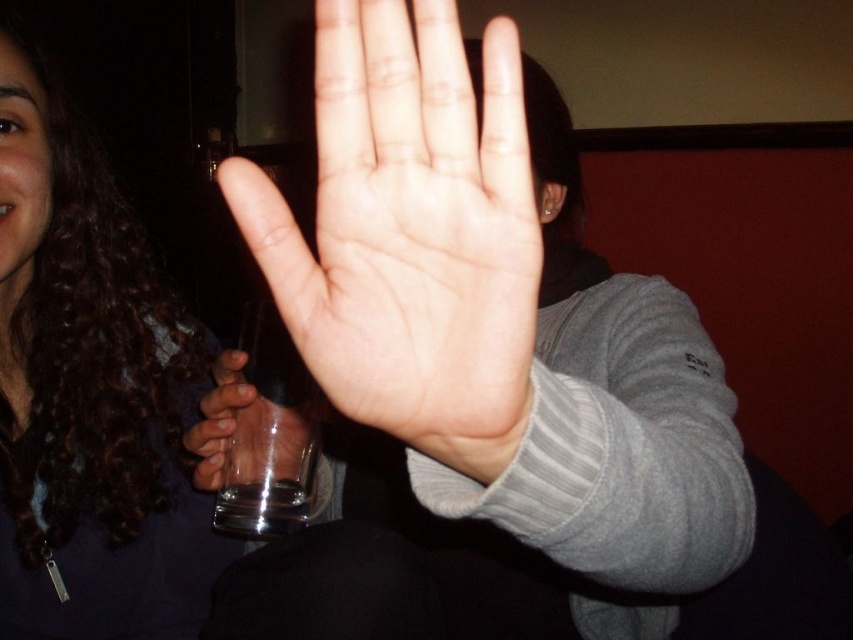
Can you confirm if smooth skin hand at center is positioned to the left of pale skin palm at center?

Incorrect, smooth skin hand at center is not on the left side of pale skin palm at center.

Is smooth skin hand at center to the right of pale skin palm at center from the viewer's perspective?

Indeed, smooth skin hand at center is positioned on the right side of pale skin palm at center.

Identify the location of smooth skin hand at center. Image resolution: width=853 pixels, height=640 pixels. (492, 316).

Which of these two, pale skin palm at center or dark curly hair at upper left, stands taller?

dark curly hair at upper left

Is point (374, 376) behind point (27, 188)?

No.

You are a GUI agent. You are given a task and a screenshot of the screen. Output one action in this format:
    pyautogui.click(x=<x>, y=<y>)
    Task: Click on the pale skin palm at center
    
    Given the screenshot: What is the action you would take?
    pyautogui.click(x=409, y=230)

Is smooth skin hand at center smaller than transparent glass at center?

No, smooth skin hand at center is not smaller than transparent glass at center.

How much distance is there between smooth skin hand at center and transparent glass at center?

smooth skin hand at center is 33.54 centimeters from transparent glass at center.

This screenshot has width=853, height=640. What are the coordinates of `smooth skin hand at center` in the screenshot? It's located at pos(492,316).